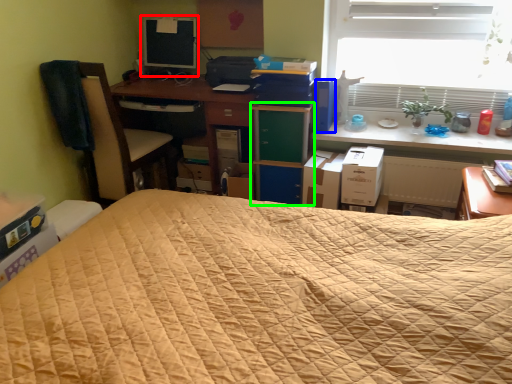
Question: Which object is the closest to the computer monitor (highlighted by a red box)? Choose among these: paperback book (highlighted by a blue box) or file cabinet (highlighted by a green box).

Choices:
 (A) paperback book
 (B) file cabinet

Answer: (B)